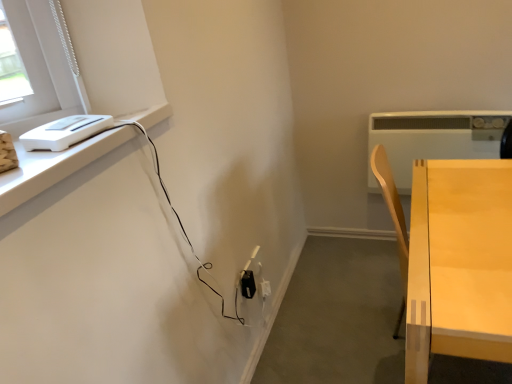
Question: Considering the relative sizes of black plastic electric outlet at lower center and white plastic heater at upper right, the 1th appliance when ordered from right to left, in the image provided, is black plastic electric outlet at lower center bigger than white plastic heater at upper right, the 1th appliance when ordered from right to left,?

Choices:
 (A) no
 (B) yes

Answer: (A)

Question: Can you see black plastic electric outlet at lower center touching white plastic heater at upper right, the 1th appliance in the back-to-front sequence?

Choices:
 (A) no
 (B) yes

Answer: (A)

Question: Does black plastic electric outlet at lower center come behind white plastic heater at upper right, the 2th appliance viewed from the front?

Choices:
 (A) yes
 (B) no

Answer: (B)

Question: From the image's perspective, does black plastic electric outlet at lower center appear higher than white plastic heater at upper right, the 1th appliance when ordered from right to left?

Choices:
 (A) yes
 (B) no

Answer: (B)

Question: Does black plastic electric outlet at lower center appear on the left side of white plastic heater at upper right, the 2th appliance viewed from the front?

Choices:
 (A) yes
 (B) no

Answer: (A)

Question: Is black plastic electric outlet at lower center wider or thinner than light wood table at right?

Choices:
 (A) thin
 (B) wide

Answer: (A)

Question: Is black plastic electric outlet at lower center in front of or behind light wood table at right in the image?

Choices:
 (A) front
 (B) behind

Answer: (B)

Question: Considering the positions of black plastic electric outlet at lower center and light wood table at right in the image, is black plastic electric outlet at lower center taller or shorter than light wood table at right?

Choices:
 (A) tall
 (B) short

Answer: (B)

Question: From the image's perspective, is black plastic electric outlet at lower center positioned above or below light wood table at right?

Choices:
 (A) below
 (B) above

Answer: (A)

Question: Looking at the image, does black plastic electric outlet at lower center seem bigger or smaller compared to white plastic heater at upper right, the 1th appliance in the back-to-front sequence?

Choices:
 (A) big
 (B) small

Answer: (B)

Question: Based on their positions, is black plastic electric outlet at lower center located to the left or right of white plastic heater at upper right, the 1th appliance in the back-to-front sequence?

Choices:
 (A) left
 (B) right

Answer: (A)

Question: Is black plastic electric outlet at lower center in front of or behind white plastic heater at upper right, the 2th appliance viewed from the front, in the image?

Choices:
 (A) behind
 (B) front

Answer: (B)

Question: Is point (247, 276) closer or farther from the camera than point (433, 129)?

Choices:
 (A) farther
 (B) closer

Answer: (B)

Question: Looking at the image, does white plastic toaster at upper left, placed as the second appliance when sorted from back to front, seem bigger or smaller compared to black plastic electric outlet at lower center?

Choices:
 (A) big
 (B) small

Answer: (A)

Question: In the image, is white plastic toaster at upper left, placed as the second appliance when sorted from back to front, positioned in front of or behind black plastic electric outlet at lower center?

Choices:
 (A) behind
 (B) front

Answer: (B)